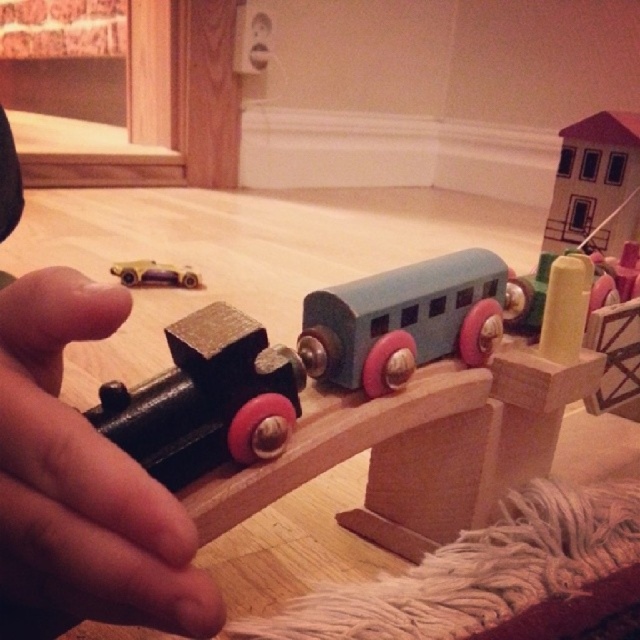
Question: Does black matte hand at center have a larger size compared to matte blue wooden train car at center?

Choices:
 (A) no
 (B) yes

Answer: (A)

Question: Which point is farther to the camera?

Choices:
 (A) (433, 296)
 (B) (148, 273)
 (C) (10, 440)

Answer: (B)

Question: In this image, where is black matte hand at center located relative to brushed metal train at center?

Choices:
 (A) above
 (B) below

Answer: (B)

Question: Does black matte hand at center appear over matte blue wooden train car at center?

Choices:
 (A) no
 (B) yes

Answer: (A)

Question: Which of the following is the closest to the observer?

Choices:
 (A) (424, 339)
 (B) (118, 269)

Answer: (A)

Question: Which point is closer to the camera?

Choices:
 (A) brushed metal train at center
 (B) metallic gold car at left
 (C) matte blue wooden train car at center

Answer: (A)